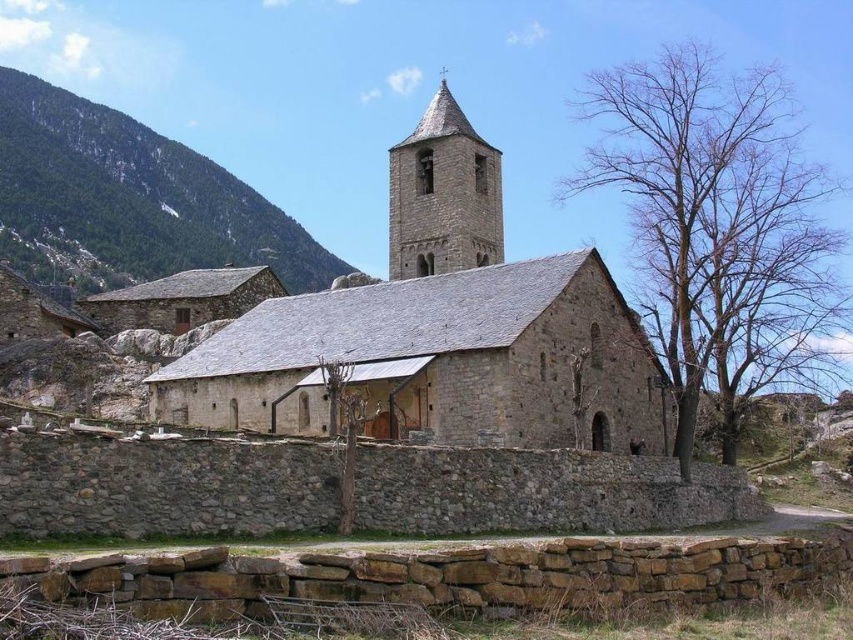
Is green forested mountain at upper left to the right of smooth stone tower at upper center from the viewer's perspective?

Incorrect, green forested mountain at upper left is not on the right side of smooth stone tower at upper center.

Looking at this image, is green forested mountain at upper left wider than smooth stone tower at upper center?

Indeed, green forested mountain at upper left has a greater width compared to smooth stone tower at upper center.

What are the coordinates of `green forested mountain at upper left` in the screenshot? It's located at (129, 198).

I want to click on green forested mountain at upper left, so click(x=129, y=198).

Looking at this image, who is shorter, gray stone church at center or smooth stone tower at upper center?

With less height is smooth stone tower at upper center.

Between point (447, 164) and point (442, 234), which one is positioned behind?

Point (447, 164)

At what (x,y) coordinates should I click in order to perform the action: click on gray stone church at center. Please return your answer as a coordinate pair (x, y). Looking at the image, I should click on (437, 326).

Can you confirm if gray stone church at center is shorter than green forested mountain at upper left?

Yes, gray stone church at center is shorter than green forested mountain at upper left.

Can you confirm if gray stone church at center is positioned above green forested mountain at upper left?

No.

Is point (444, 264) farther from camera compared to point (252, 257)?

No, (444, 264) is in front of (252, 257).

You are a GUI agent. You are given a task and a screenshot of the screen. Output one action in this format:
    pyautogui.click(x=<x>, y=<y>)
    Task: Click on the gray stone church at center
    The image size is (853, 640).
    Given the screenshot: What is the action you would take?
    pyautogui.click(x=437, y=326)